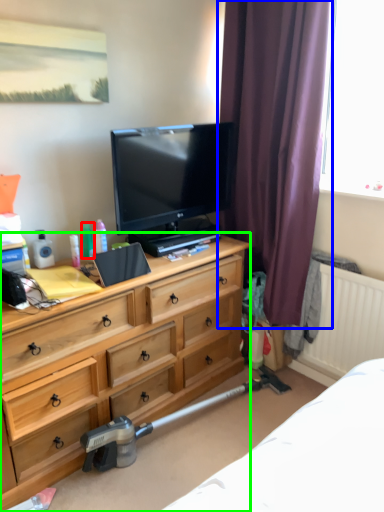
Question: Considering the real-world distances, which object is closest to toiletry (highlighted by a red box)? curtain (highlighted by a blue box) or chest of drawers (highlighted by a green box).

Choices:
 (A) curtain
 (B) chest of drawers

Answer: (B)